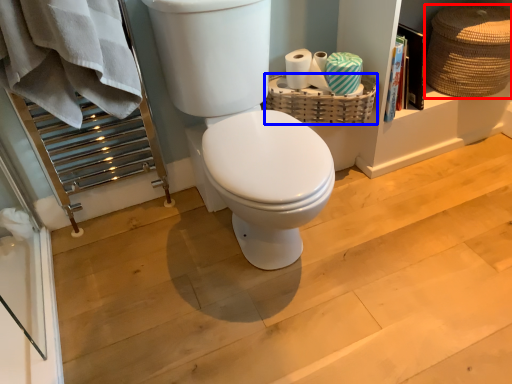
Question: Which object is closer to the camera taking this photo, basket (highlighted by a red box) or basket (highlighted by a blue box)?

Choices:
 (A) basket
 (B) basket

Answer: (A)